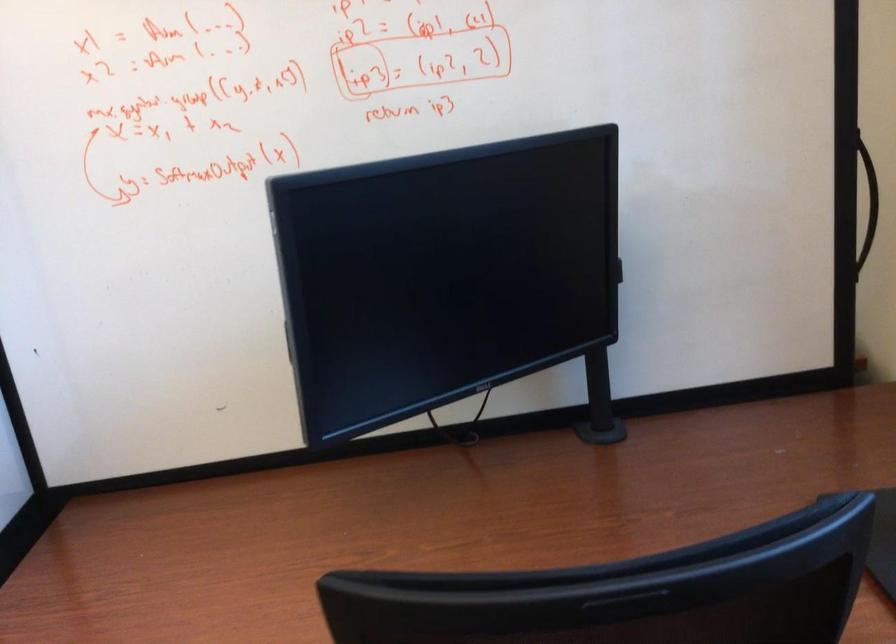
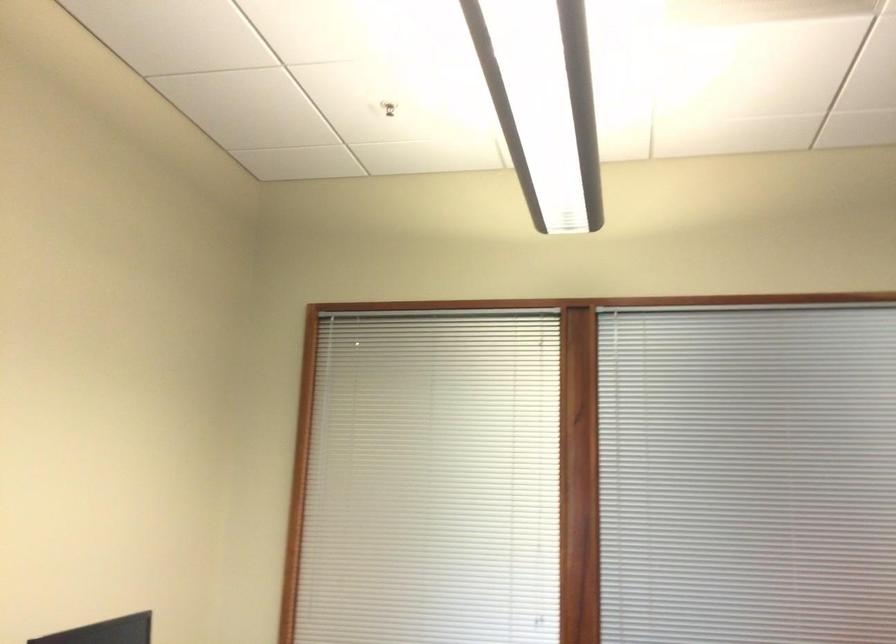
Question: The camera is either moving clockwise (left) or counter-clockwise (right) around the object. The first image is from the beginning of the video and the second image is from the end. Is the camera moving left or right when shooting the video?

Choices:
 (A) Left
 (B) Right

Answer: (B)